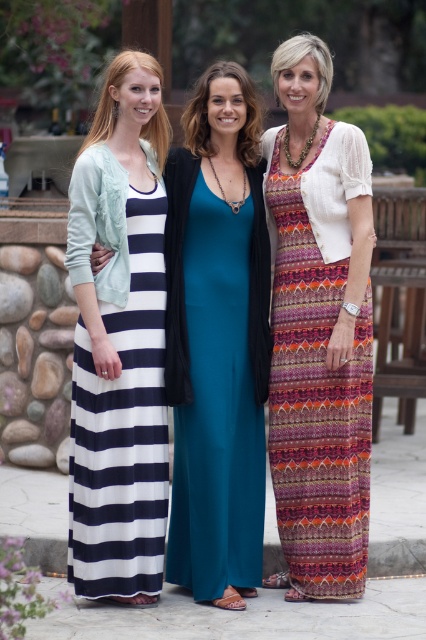
Question: Which of the following is the farthest from the observer?

Choices:
 (A) (222, 250)
 (B) (141, 572)
 (C) (285, 248)
 (D) (195, 218)

Answer: (C)

Question: Is teal satin dress at center in front of navy/white striped dress at left?

Choices:
 (A) no
 (B) yes

Answer: (A)

Question: Observing the image, what is the correct spatial positioning of patterned knit dress at center in reference to multicolored woven dress at right?

Choices:
 (A) left
 (B) right

Answer: (A)

Question: Which object appears closest to the camera in this image?

Choices:
 (A) multicolored woven dress at right
 (B) navy/white striped dress at left

Answer: (B)

Question: Is patterned knit dress at center bigger than navy/white striped dress at left?

Choices:
 (A) yes
 (B) no

Answer: (A)

Question: Which point is farther to the camera?

Choices:
 (A) (169, 337)
 (B) (302, 579)

Answer: (B)